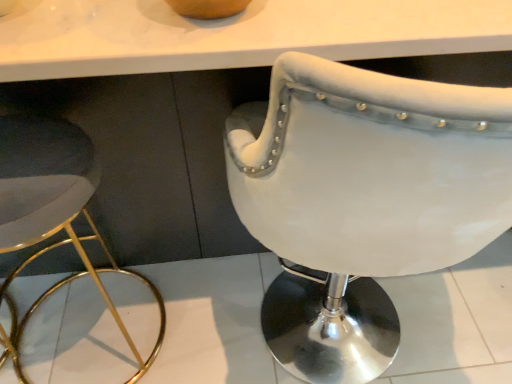
Question: Based on their sizes in the image, would you say white leather chair at center is bigger or smaller than white leather stool at left?

Choices:
 (A) big
 (B) small

Answer: (A)

Question: Relative to white leather stool at left, is white leather chair at center in front or behind?

Choices:
 (A) behind
 (B) front

Answer: (B)

Question: Do you think white leather chair at center is within white leather stool at left, or outside of it?

Choices:
 (A) inside
 (B) outside

Answer: (B)

Question: From a real-world perspective, relative to white leather chair at center, is white leather stool at left vertically above or below?

Choices:
 (A) below
 (B) above

Answer: (A)

Question: In terms of height, does white leather stool at left look taller or shorter compared to white leather chair at center?

Choices:
 (A) short
 (B) tall

Answer: (A)

Question: Based on their sizes in the image, would you say white leather stool at left is bigger or smaller than white leather chair at center?

Choices:
 (A) big
 (B) small

Answer: (B)

Question: Looking at their shapes, would you say white leather stool at left is wider or thinner than white leather chair at center?

Choices:
 (A) wide
 (B) thin

Answer: (B)